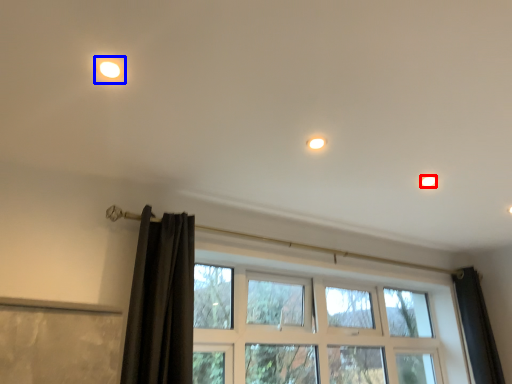
Question: Which point is further to the camera, dot (highlighted by a red box) or light (highlighted by a blue box)?

Choices:
 (A) dot
 (B) light

Answer: (A)